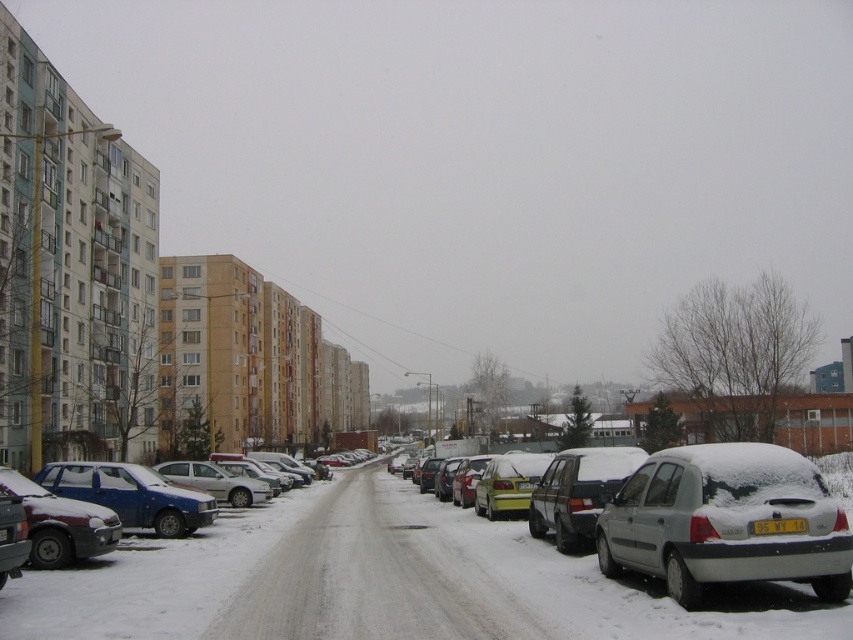
Is blue matte sedan at lower left below white plastic license plate at center?

Indeed, blue matte sedan at lower left is positioned under white plastic license plate at center.

Between blue matte sedan at lower left and white plastic license plate at center, which one has more height?

blue matte sedan at lower left

Between point (154, 518) and point (750, 532), which one is positioned behind?

The point (154, 518) is more distant.

Image resolution: width=853 pixels, height=640 pixels. Find the location of `blue matte sedan at lower left`. blue matte sedan at lower left is located at coordinates (132, 496).

Does white matte car at lower right have a smaller size compared to white plastic license plate at center?

Actually, white matte car at lower right might be larger than white plastic license plate at center.

Is white matte car at lower right bigger than white plastic license plate at center?

Yes, white matte car at lower right is bigger than white plastic license plate at center.

Between point (651, 545) and point (767, 524), which one is positioned in front?

Positioned in front is point (767, 524).

Locate an element on the screen. The height and width of the screenshot is (640, 853). white matte car at lower right is located at coordinates (724, 522).

Does blue matte sedan at lower left have a greater height compared to matte silver sedan at lower left?

Correct, blue matte sedan at lower left is much taller as matte silver sedan at lower left.

Who is more distant from viewer, [144,472] or [9,538]?

Positioned behind is point [144,472].

Based on the photo, who is more distant from viewer, [74,468] or [0,577]?

The point [74,468] is behind.

Find the location of `blue matte sedan at lower left`. blue matte sedan at lower left is located at coordinates (132, 496).